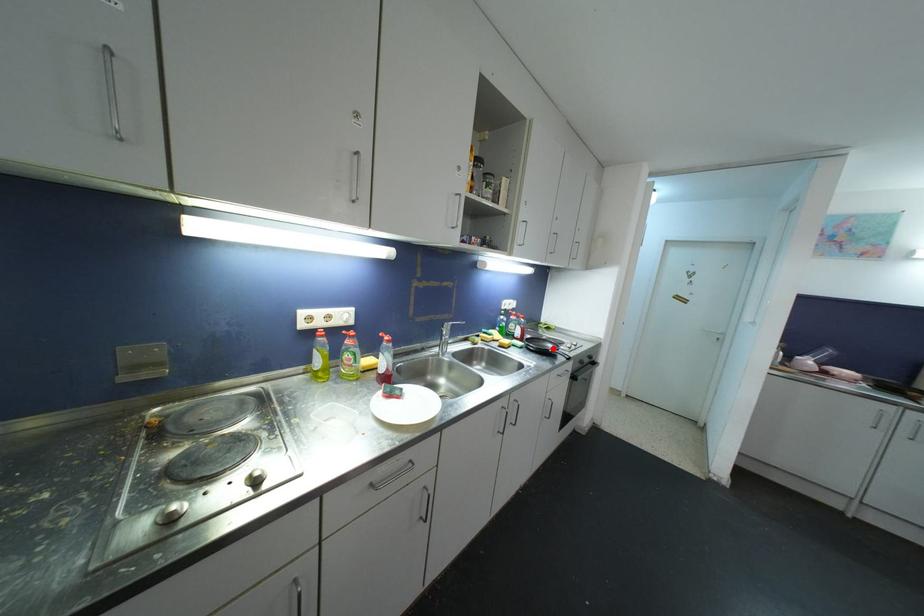
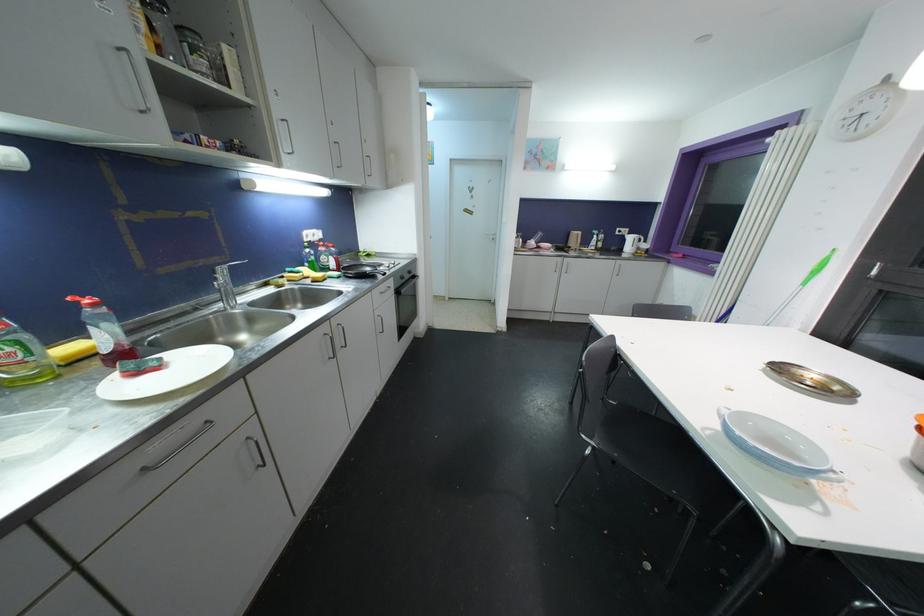
Locate, in the second image, the point that corresponds to the highlighted location in the first image.

(371, 272)